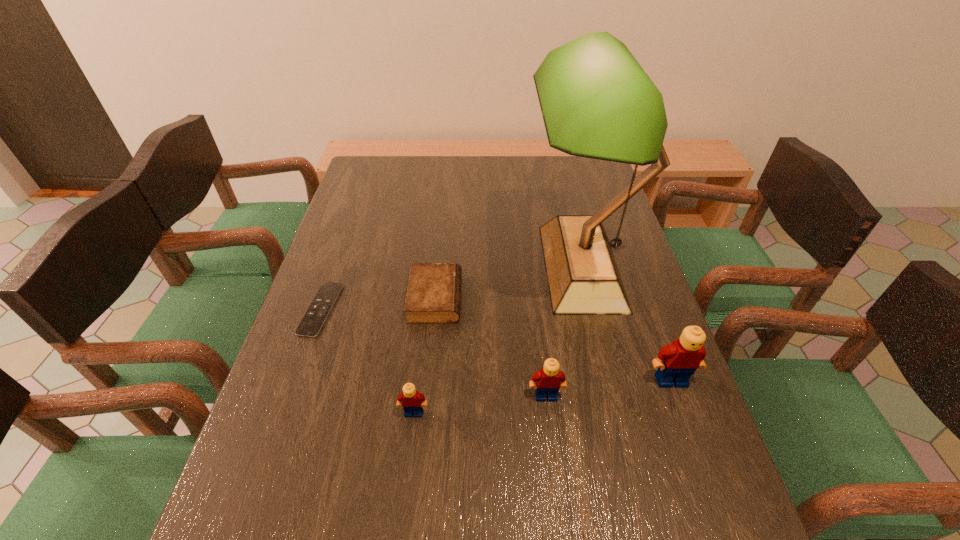
Where is `blank space located 0.140m on the front-facing side of the shortest Lego`? blank space located 0.140m on the front-facing side of the shortest Lego is located at coordinates (405, 488).

Where is `vacant space located 0.170m on the front-facing side of the second nearest object`? This screenshot has width=960, height=540. vacant space located 0.170m on the front-facing side of the second nearest object is located at coordinates (557, 484).

Find the location of a particular element. The image size is (960, 540). free space located 0.120m on the front-facing side of the rightmost Lego is located at coordinates (693, 442).

You are a GUI agent. You are given a task and a screenshot of the screen. Output one action in this format:
    pyautogui.click(x=<x>, y=<y>)
    Task: Click on the free location located on the spine side of the diary
    Image resolution: width=960 pixels, height=540 pixels.
    Given the screenshot: What is the action you would take?
    pyautogui.click(x=538, y=298)

Identify the location of free spot located 0.290m on the right of the shortest object. The height and width of the screenshot is (540, 960). (449, 309).

Where is `vacant space located 0.300m on the metallic stand of the tallest object`? This screenshot has width=960, height=540. vacant space located 0.300m on the metallic stand of the tallest object is located at coordinates (419, 267).

Where is `free space located on the metallic stand of the tallest object`? free space located on the metallic stand of the tallest object is located at coordinates (x=479, y=267).

At what (x,y) coordinates should I click in order to perform the action: click on free space located on the metallic stand of the tallest object. Please return your answer as a coordinate pair (x, y). Image resolution: width=960 pixels, height=540 pixels. Looking at the image, I should click on (395, 267).

Locate an element on the screen. This screenshot has height=540, width=960. object situated at the left edge is located at coordinates (312, 322).

Image resolution: width=960 pixels, height=540 pixels. Find the location of `Lego at the right edge`. Lego at the right edge is located at coordinates (676, 362).